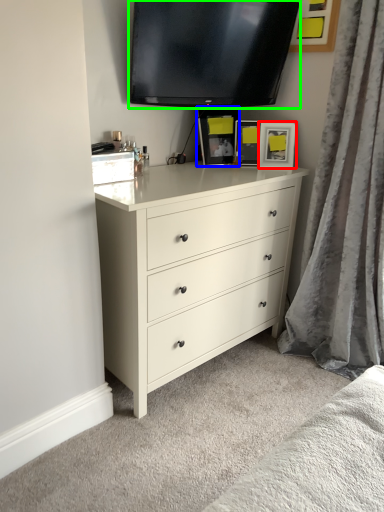
Question: Based on their relative distances, which object is nearer to picture frame (highlighted by a red box)? Choose from picture frame (highlighted by a blue box) and television (highlighted by a green box).

Choices:
 (A) picture frame
 (B) television

Answer: (A)